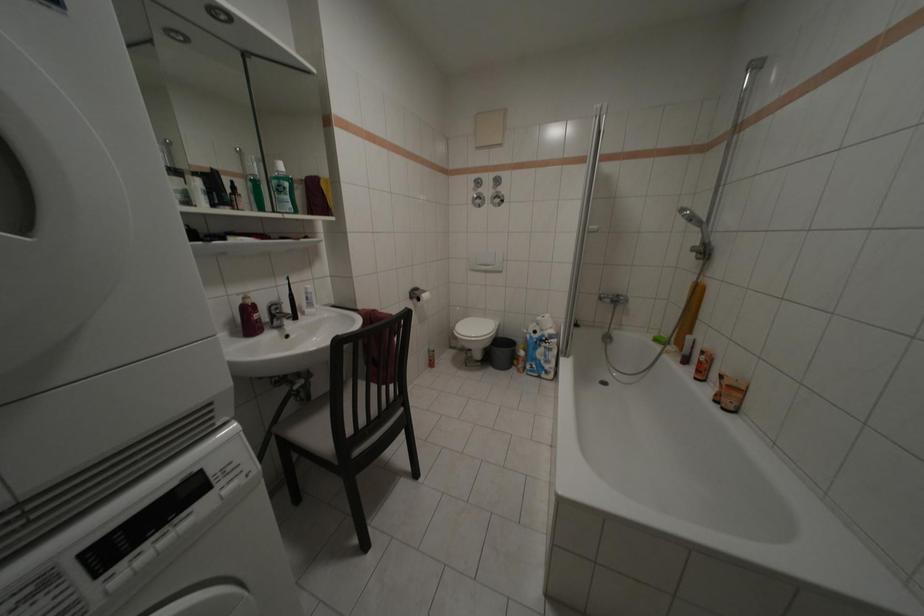
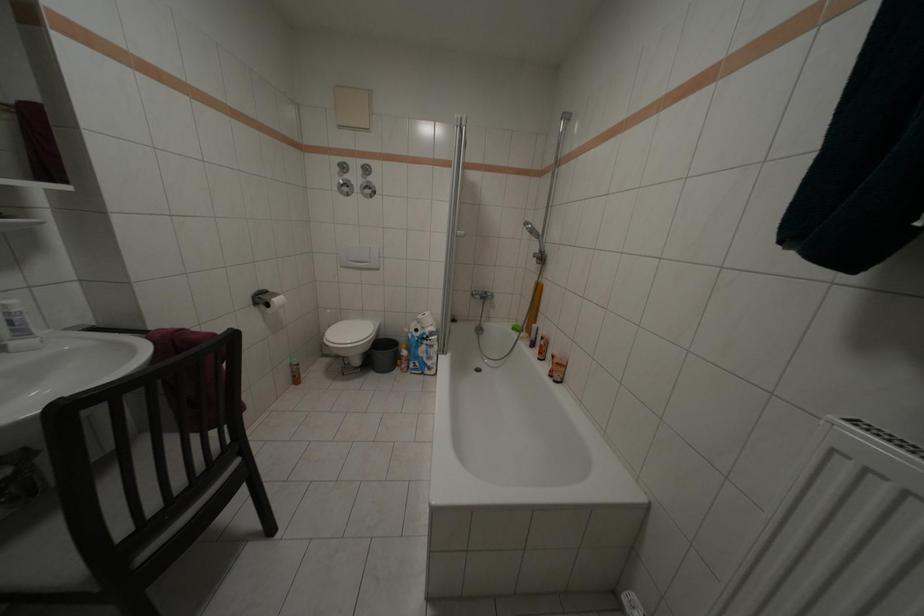
The images are taken continuously from a first-person perspective. In which direction are you moving?

The cameraman moved toward right, forward.